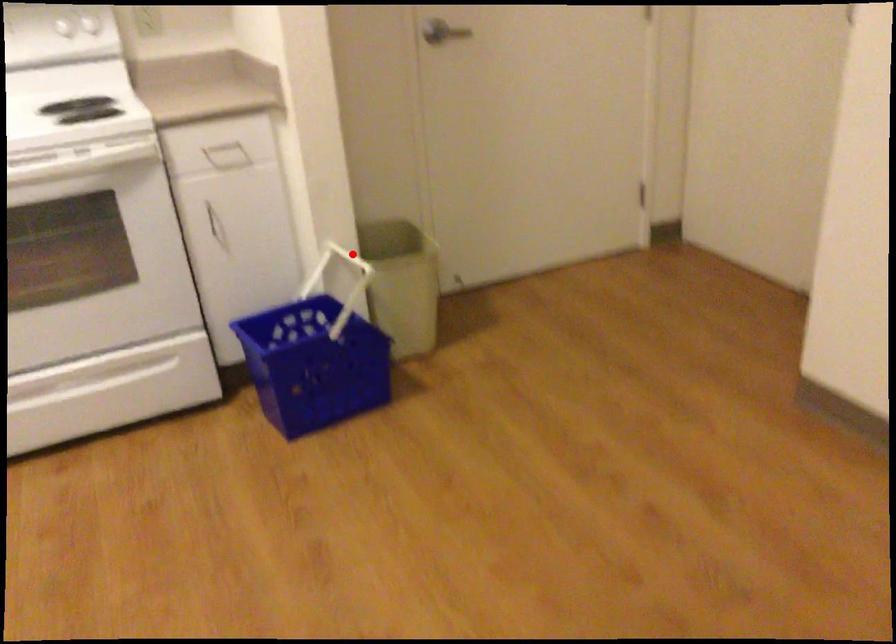
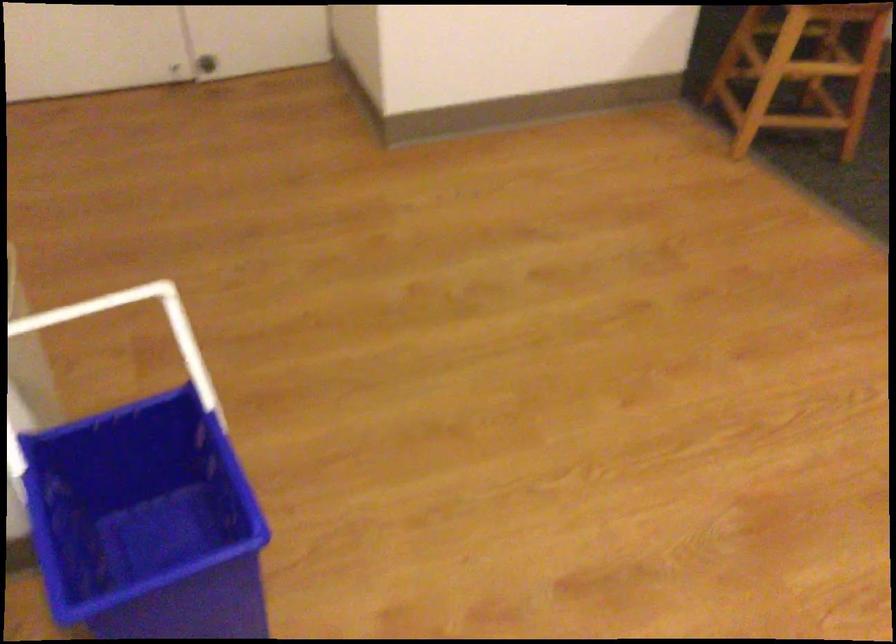
Question: I am providing you with two images of the same scene from different viewpoints. In image1, a red point is highlighted. Considering the same 3D point in image2, which of the following is correct?

Choices:
 (A) It is closer
 (B) It is farther

Answer: (A)